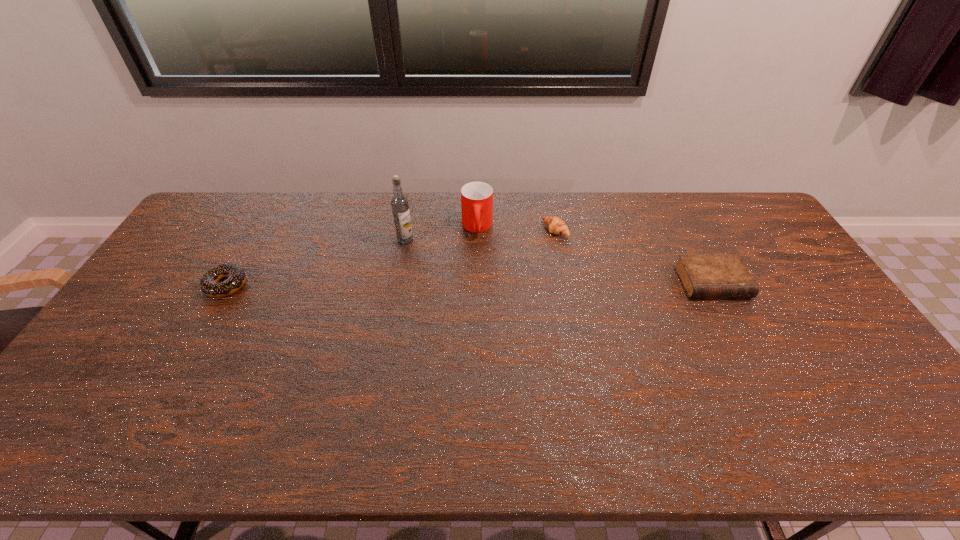
Locate an element on the screen. This screenshot has height=540, width=960. vacant space located 0.190m on the label of the tallest object is located at coordinates (406, 286).

The image size is (960, 540). What are the coordinates of `free space located on the label of the tallest object` in the screenshot? It's located at (406, 258).

This screenshot has width=960, height=540. I want to click on vacant space located 0.250m on the front-facing side of the pastry, so click(492, 269).

What are the coordinates of `free space located on the front-facing side of the pastry` in the screenshot? It's located at (469, 281).

You are a GUI agent. You are given a task and a screenshot of the screen. Output one action in this format:
    pyautogui.click(x=<x>, y=<y>)
    Task: Click on the vacant space located on the front-facing side of the pastry
    This screenshot has height=540, width=960.
    Given the screenshot: What is the action you would take?
    pyautogui.click(x=532, y=245)

Identify the location of blank area located on the side of the fourth shortest object with the handle. (477, 255).

Locate an element on the screen. The height and width of the screenshot is (540, 960). blank area located on the side of the fourth shortest object with the handle is located at coordinates (477, 251).

You are a GUI agent. You are given a task and a screenshot of the screen. Output one action in this format:
    pyautogui.click(x=<x>, y=<y>)
    Task: Click on the vacant region located on the side of the fourth shortest object with the handle
    
    Given the screenshot: What is the action you would take?
    pyautogui.click(x=476, y=277)

The width and height of the screenshot is (960, 540). Find the location of `pastry that is at the far edge`. pastry that is at the far edge is located at coordinates click(x=555, y=225).

The image size is (960, 540). What are the coordinates of `cup that is at the far edge` in the screenshot? It's located at (476, 197).